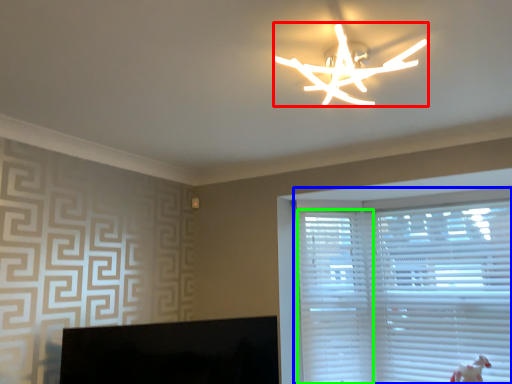
Question: Which object is the farthest from lamp (highlighted by a red box)? Choose among these: window blind (highlighted by a blue box) or blind (highlighted by a green box).

Choices:
 (A) window blind
 (B) blind

Answer: (B)